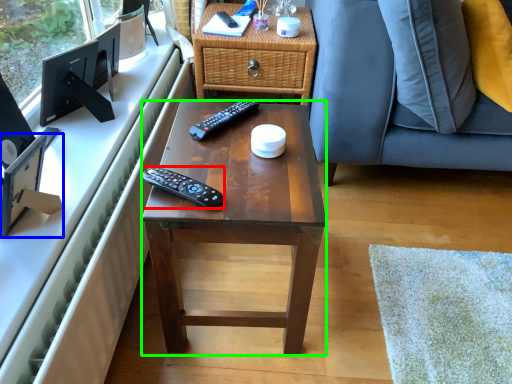
Question: Considering the real-world distances, which object is farthest from remote control (highlighted by a red box)? television (highlighted by a blue box) or desk (highlighted by a green box)?

Choices:
 (A) television
 (B) desk

Answer: (A)